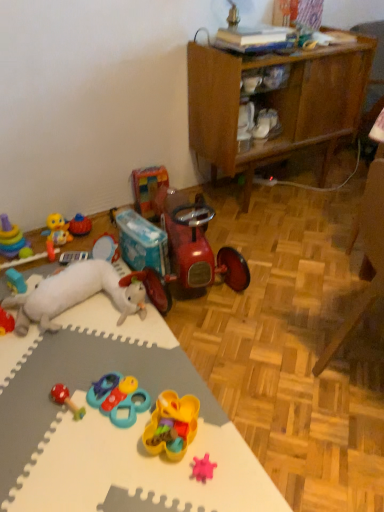
At what (x,y) coordinates should I click in order to perform the action: click on vacant area that lies between rubberized red and green toy at lower left, the 7th toy from the left, and white plush toy at upper left, the eighth toy when ordered from right to left. Please return your answer as a coordinate pair (x, y). The height and width of the screenshot is (512, 384). Looking at the image, I should click on (84, 355).